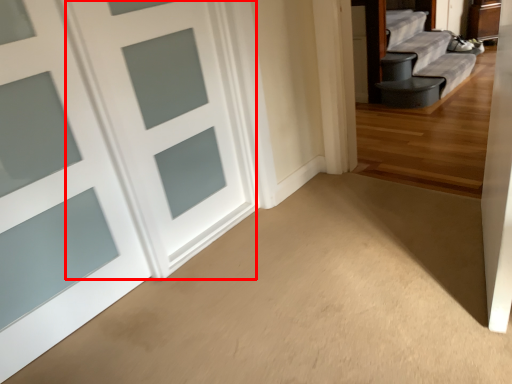
Question: From the image's perspective, what is the correct spatial relationship of door (annotated by the red box) in relation to door?

Choices:
 (A) above
 (B) below

Answer: (A)